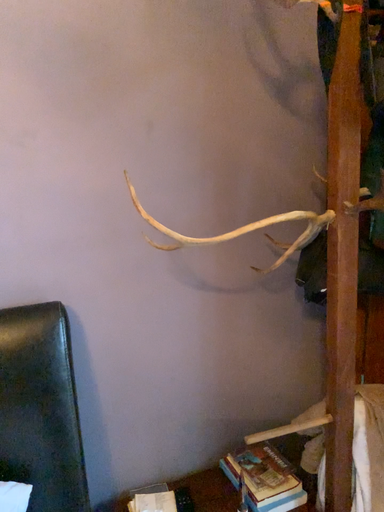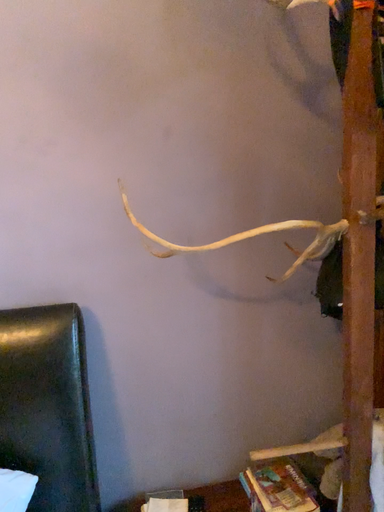
Question: Which way did the camera rotate in the video?

Choices:
 (A) rotated left
 (B) rotated right

Answer: (A)